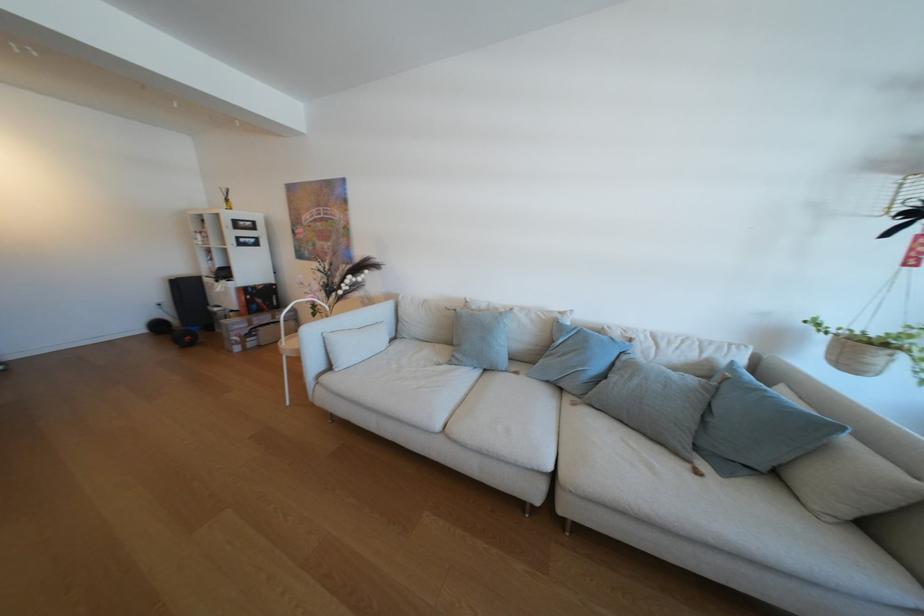
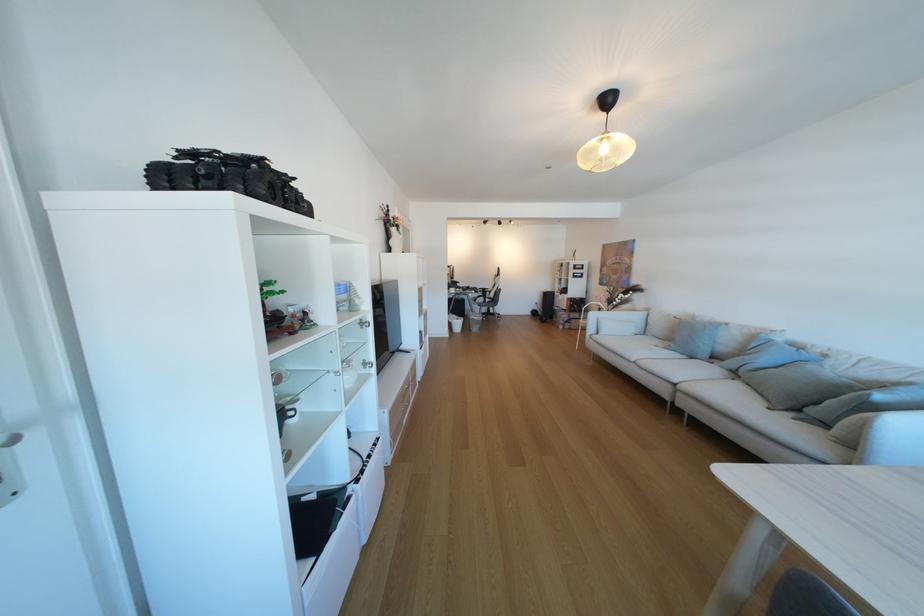
Locate, in the second image, the point that corresponds to point 528,374 in the first image.

(723, 363)